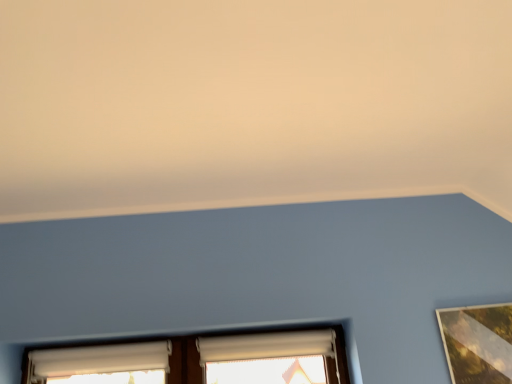
This screenshot has height=384, width=512. I want to click on white fabric window at center, which is the 2th window in left-to-right order, so click(271, 358).

Describe the element at coordinates (271, 358) in the screenshot. I see `white fabric window at center, marked as the 1th window in a right-to-left arrangement` at that location.

Image resolution: width=512 pixels, height=384 pixels. I want to click on white matte window at lower left, which is counted as the first window, starting from the left, so click(101, 364).

This screenshot has height=384, width=512. What do you see at coordinates (101, 364) in the screenshot?
I see `white matte window at lower left, which is counted as the first window, starting from the left` at bounding box center [101, 364].

The width and height of the screenshot is (512, 384). Identify the location of white fabric window at center, which is the 2th window in left-to-right order. (271, 358).

Which object is positioned more to the right, white matte window at lower left, which is counted as the first window, starting from the left, or white fabric window at center, which is the 2th window in left-to-right order?

Positioned to the right is white fabric window at center, which is the 2th window in left-to-right order.

Who is more distant, white matte window at lower left, placed as the second window when sorted from right to left, or white fabric window at center, marked as the 1th window in a right-to-left arrangement?

Positioned behind is white fabric window at center, marked as the 1th window in a right-to-left arrangement.

Considering the positions of point (78, 348) and point (290, 343), is point (78, 348) closer or farther from the camera than point (290, 343)?

Point (78, 348) is positioned closer to the camera compared to point (290, 343).

From the image's perspective, is white matte window at lower left, which is counted as the first window, starting from the left, located above or below white fabric window at center, which is the 2th window in left-to-right order?

Clearly, from the image's perspective, white matte window at lower left, which is counted as the first window, starting from the left, is below white fabric window at center, which is the 2th window in left-to-right order.

From a real-world perspective, is white matte window at lower left, placed as the second window when sorted from right to left, under white fabric window at center, marked as the 1th window in a right-to-left arrangement?

Yes, from a real-world perspective, white matte window at lower left, placed as the second window when sorted from right to left, is under white fabric window at center, marked as the 1th window in a right-to-left arrangement.

Is white matte window at lower left, placed as the second window when sorted from right to left, wider than white fabric window at center, which is the 2th window in left-to-right order?

Indeed, white matte window at lower left, placed as the second window when sorted from right to left, has a greater width compared to white fabric window at center, which is the 2th window in left-to-right order.

Is white matte window at lower left, which is counted as the first window, starting from the left, taller or shorter than white fabric window at center, marked as the 1th window in a right-to-left arrangement?

In the image, white matte window at lower left, which is counted as the first window, starting from the left, appears to be taller than white fabric window at center, marked as the 1th window in a right-to-left arrangement.

Can you confirm if white matte window at lower left, which is counted as the first window, starting from the left, is bigger than white fabric window at center, marked as the 1th window in a right-to-left arrangement?

Yes, white matte window at lower left, which is counted as the first window, starting from the left, is bigger than white fabric window at center, marked as the 1th window in a right-to-left arrangement.

Is white matte window at lower left, placed as the second window when sorted from right to left, not inside white fabric window at center, marked as the 1th window in a right-to-left arrangement?

Yes, white matte window at lower left, placed as the second window when sorted from right to left, is not within white fabric window at center, marked as the 1th window in a right-to-left arrangement.

Is white matte window at lower left, which is counted as the first window, starting from the left, in contact with white fabric window at center, marked as the 1th window in a right-to-left arrangement?

No, white matte window at lower left, which is counted as the first window, starting from the left, is not next to white fabric window at center, marked as the 1th window in a right-to-left arrangement.

Could you tell me if white matte window at lower left, which is counted as the first window, starting from the left, is facing white fabric window at center, which is the 2th window in left-to-right order?

No, white matte window at lower left, which is counted as the first window, starting from the left, is not aimed at white fabric window at center, which is the 2th window in left-to-right order.

From the picture: Measure the distance from white matte window at lower left, placed as the second window when sorted from right to left, to white fabric window at center, which is the 2th window in left-to-right order.

white matte window at lower left, placed as the second window when sorted from right to left, and white fabric window at center, which is the 2th window in left-to-right order, are 17.20 inches apart.

Locate an element on the screen. The height and width of the screenshot is (384, 512). window above the white matte window at lower left, placed as the second window when sorted from right to left (from a real-world perspective) is located at coordinates (271, 358).

Between white fabric window at center, marked as the 1th window in a right-to-left arrangement, and white matte window at lower left, which is counted as the first window, starting from the left, which one appears on the left side from the viewer's perspective?

white matte window at lower left, which is counted as the first window, starting from the left.

In the image, is white fabric window at center, marked as the 1th window in a right-to-left arrangement, positioned in front of or behind white matte window at lower left, placed as the second window when sorted from right to left?

In the image, white fabric window at center, marked as the 1th window in a right-to-left arrangement, appears behind white matte window at lower left, placed as the second window when sorted from right to left.

Which is in front, point (261, 348) or point (161, 353)?

The point (161, 353) is closer to the camera.

From the image's perspective, which is below, white fabric window at center, which is the 2th window in left-to-right order, or white matte window at lower left, which is counted as the first window, starting from the left?

From the image's view, white matte window at lower left, which is counted as the first window, starting from the left, is below.

From a real-world perspective, does white fabric window at center, marked as the 1th window in a right-to-left arrangement, stand above white matte window at lower left, which is counted as the first window, starting from the left?

Yes, from a real-world perspective, white fabric window at center, marked as the 1th window in a right-to-left arrangement, is over white matte window at lower left, which is counted as the first window, starting from the left

Is white fabric window at center, marked as the 1th window in a right-to-left arrangement, wider or thinner than white matte window at lower left, placed as the second window when sorted from right to left?

Clearly, white fabric window at center, marked as the 1th window in a right-to-left arrangement, has less width compared to white matte window at lower left, placed as the second window when sorted from right to left.

Who is taller, white fabric window at center, which is the 2th window in left-to-right order, or white matte window at lower left, which is counted as the first window, starting from the left?

white matte window at lower left, which is counted as the first window, starting from the left, is taller.

Does white fabric window at center, marked as the 1th window in a right-to-left arrangement, have a larger size compared to white matte window at lower left, which is counted as the first window, starting from the left?

Actually, white fabric window at center, marked as the 1th window in a right-to-left arrangement, might be smaller than white matte window at lower left, which is counted as the first window, starting from the left.

Is white fabric window at center, which is the 2th window in left-to-right order, inside or outside of white matte window at lower left, placed as the second window when sorted from right to left?

white fabric window at center, which is the 2th window in left-to-right order, is located beyond the bounds of white matte window at lower left, placed as the second window when sorted from right to left.

Are white fabric window at center, marked as the 1th window in a right-to-left arrangement, and white matte window at lower left, placed as the second window when sorted from right to left, making contact?

white fabric window at center, marked as the 1th window in a right-to-left arrangement, and white matte window at lower left, placed as the second window when sorted from right to left, are clearly separated.

Is white fabric window at center, marked as the 1th window in a right-to-left arrangement, aimed at white matte window at lower left, placed as the second window when sorted from right to left?

No, white fabric window at center, marked as the 1th window in a right-to-left arrangement, does not turn towards white matte window at lower left, placed as the second window when sorted from right to left.

How different are the orientations of white fabric window at center, marked as the 1th window in a right-to-left arrangement, and white matte window at lower left, which is counted as the first window, starting from the left, in degrees?

They differ by 0.00299 degrees in their facing directions.

How far apart are white fabric window at center, marked as the 1th window in a right-to-left arrangement, and white matte window at lower left, placed as the second window when sorted from right to left?

A distance of 17.20 inches exists between white fabric window at center, marked as the 1th window in a right-to-left arrangement, and white matte window at lower left, placed as the second window when sorted from right to left.

At what (x,y) coordinates should I click in order to perform the action: click on window above the white matte window at lower left, which is counted as the first window, starting from the left (from the image's perspective). Please return your answer as a coordinate pair (x, y). This screenshot has width=512, height=384. Looking at the image, I should click on (271, 358).

The height and width of the screenshot is (384, 512). What are the coordinates of `window below the white fabric window at center, marked as the 1th window in a right-to-left arrangement (from the image's perspective)` in the screenshot? It's located at (101, 364).

In the image, there is a white fabric window at center, which is the 2th window in left-to-right order. Where is `window below it (from a real-world perspective)`? This screenshot has height=384, width=512. window below it (from a real-world perspective) is located at coordinates (101, 364).